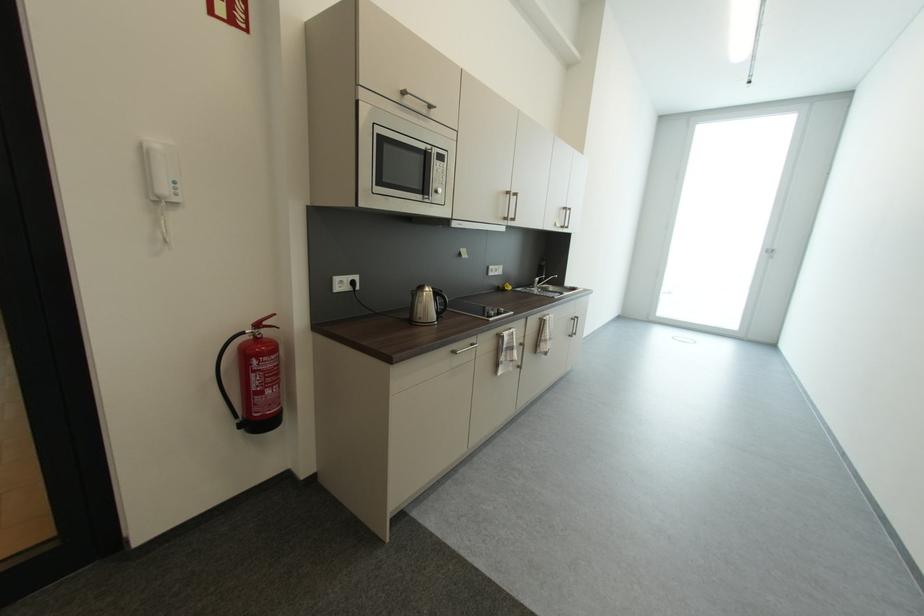
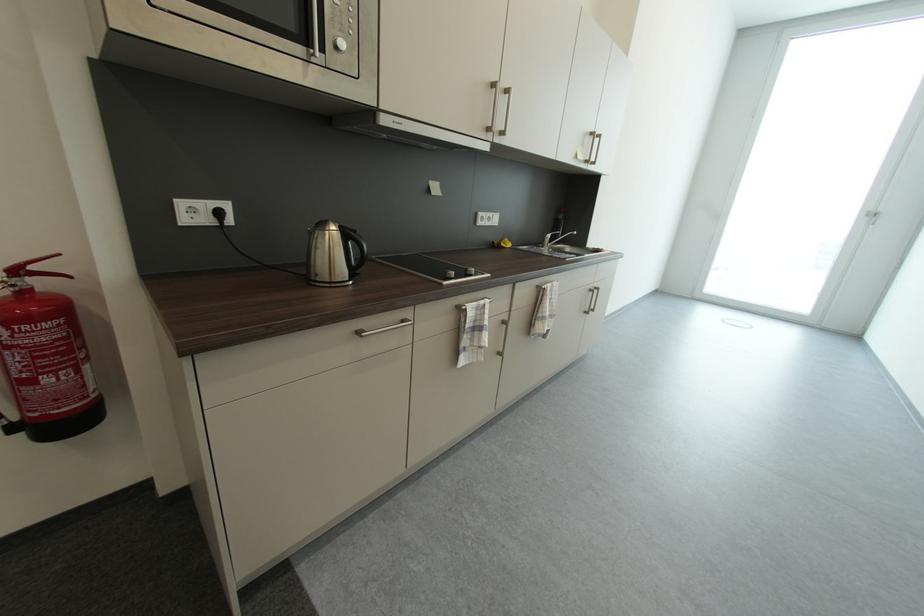
Question: The images are taken continuously from a first-person perspective. In which direction is your viewpoint rotating?

Choices:
 (A) Left
 (B) Right
 (C) Up
 (D) Down

Answer: (D)